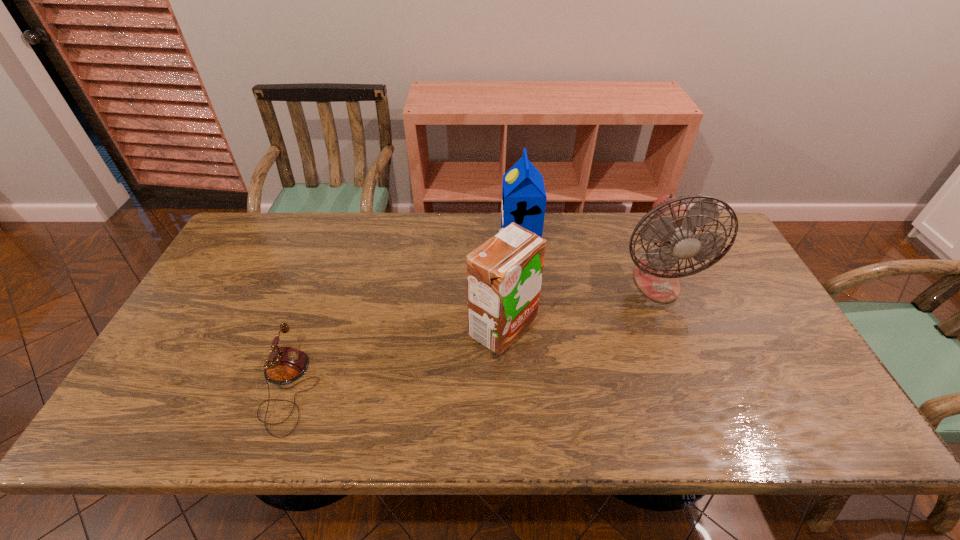
Locate an element on the screen. vacant space located 0.180m on the straw side of the nearer carton is located at coordinates (400, 328).

Identify the location of free region located 0.190m on the straw side of the nearer carton. (396, 328).

This screenshot has width=960, height=540. In order to click on blank space located 0.210m on the rotary dial of the shortest object in this screenshot , I will do `click(406, 388)`.

Find the location of `fan that is at the far edge`. fan that is at the far edge is located at coordinates coord(674,227).

Find the location of a particular element. carton that is at the far edge is located at coordinates (524, 198).

Identify the location of object positioned at the near edge. The image size is (960, 540). (287, 364).

In order to click on object located in the right edge section of the desktop in this screenshot , I will do `click(674, 227)`.

This screenshot has width=960, height=540. Identify the location of object that is at the far right corner. (674, 227).

Locate an element on the screen. vacant space at the far edge of the desktop is located at coordinates (342, 235).

I want to click on free space at the near edge of the desktop, so 545,433.